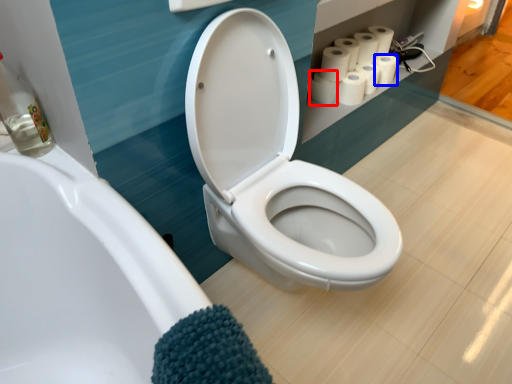
Question: Among these objects, which one is farthest to the camera, toilet paper (highlighted by a red box) or toilet paper (highlighted by a blue box)?

Choices:
 (A) toilet paper
 (B) toilet paper

Answer: (B)